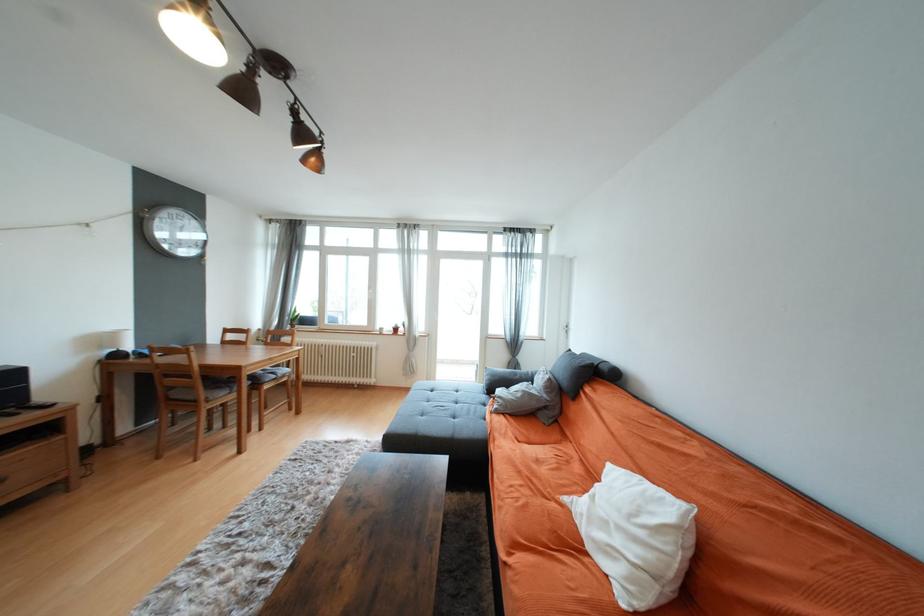
Where is `drawer handle`? drawer handle is located at coordinates (5, 482).